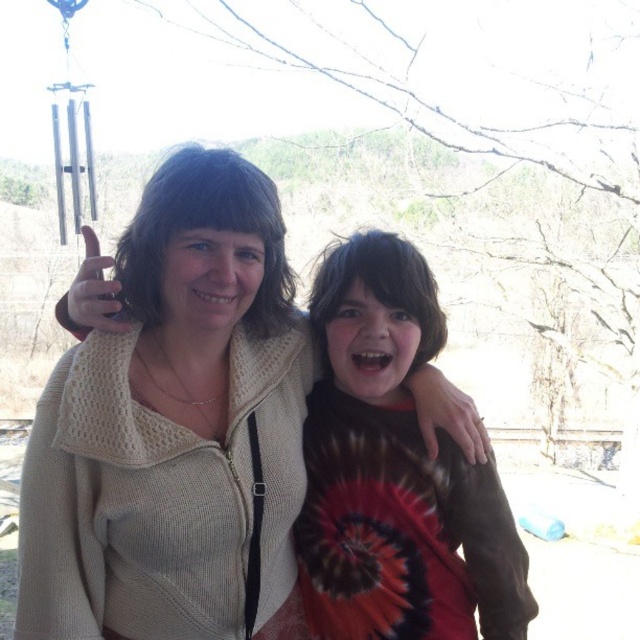
Can you confirm if white knitted sweater at center is bigger than matte skin hand at upper left?

Indeed, white knitted sweater at center has a larger size compared to matte skin hand at upper left.

Which is below, white knitted sweater at center or matte skin hand at upper left?

white knitted sweater at center is lower down.

Who is more distant from viewer, (268, 609) or (93, 323)?

The point (268, 609) is behind.

You are a GUI agent. You are given a task and a screenshot of the screen. Output one action in this format:
    pyautogui.click(x=<x>, y=<y>)
    Task: Click on the white knitted sweater at center
    
    Given the screenshot: What is the action you would take?
    pyautogui.click(x=173, y=428)

Can you confirm if white knitted sweater at center is thinner than matte brown hand at center?

No.

Is white knitted sweater at center closer to camera compared to matte brown hand at center?

Yes, white knitted sweater at center is closer to the viewer.

Is point (212, 634) less distant than point (426, 388)?

Yes, it is.

Locate an element on the screen. white knitted sweater at center is located at coordinates coord(173,428).

Between point (419, 346) and point (68, 305), which one is positioned in front?

Positioned in front is point (68, 305).

Is point (396, 481) positioned in front of point (76, 284)?

No.

The height and width of the screenshot is (640, 640). What are the coordinates of `tie-dye fabric shirt at center` in the screenshot? It's located at (394, 472).